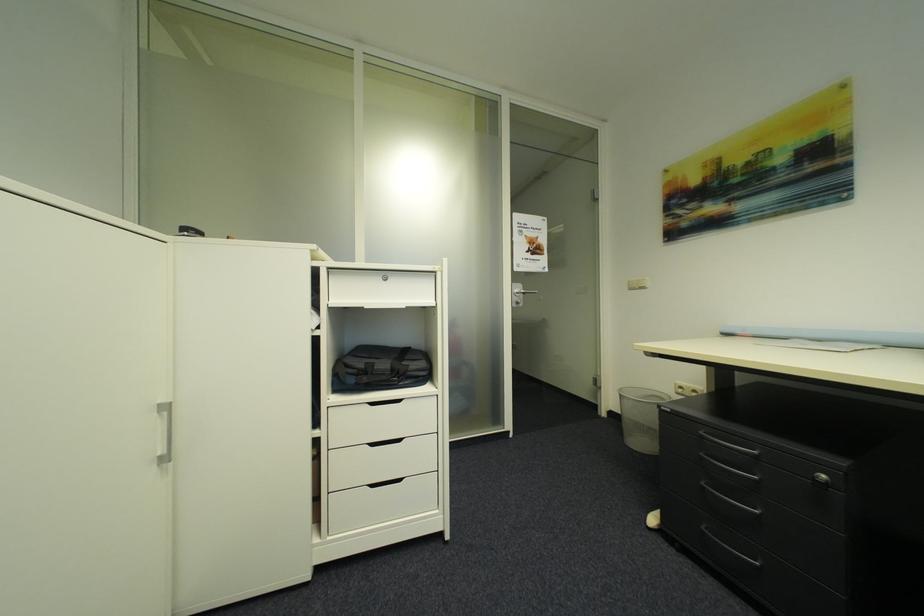
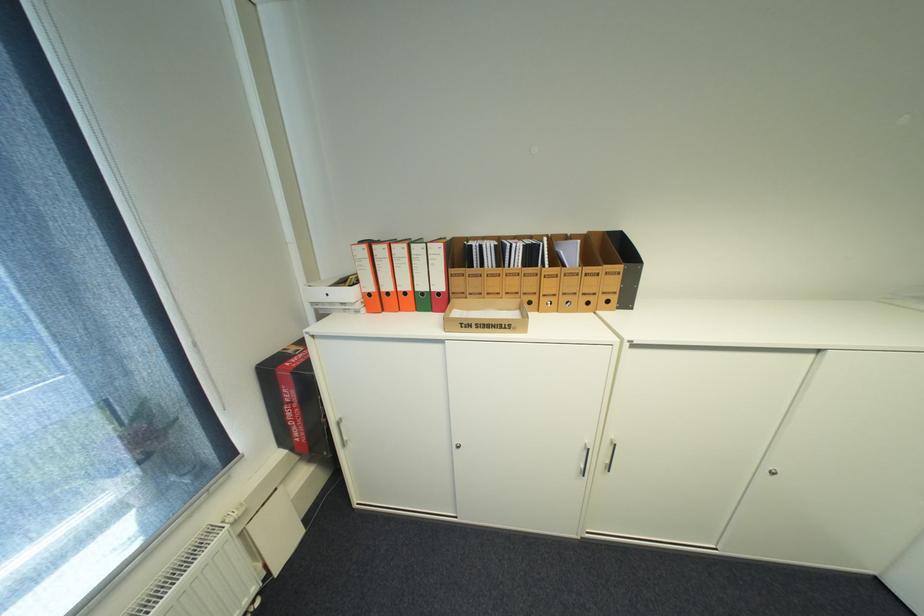
How did the camera likely rotate?

The camera's rotation is toward left-down.